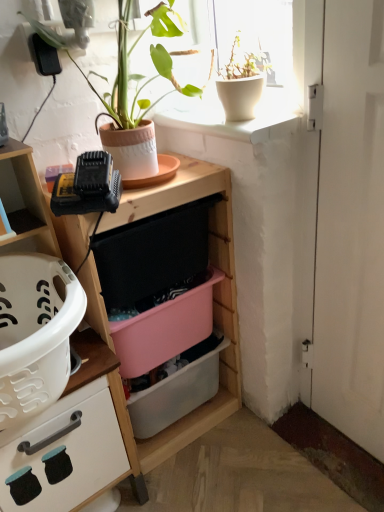
Question: Considering the positions of wooden shelf at center and pink plastic storage box at center, placed as the second storage box when sorted from top to bottom, in the image, is wooden shelf at center bigger or smaller than pink plastic storage box at center, placed as the second storage box when sorted from top to bottom,?

Choices:
 (A) small
 (B) big

Answer: (B)

Question: From the image's perspective, is wooden shelf at center located above or below pink plastic storage box at center, placed as the second storage box when sorted from top to bottom?

Choices:
 (A) below
 (B) above

Answer: (B)

Question: Which of these objects is positioned farthest from the matte wood cabinet at left?

Choices:
 (A) wooden shelf at center
 (B) white matte door at right
 (C) pink plastic storage box at center, which ranks as the 1th storage box in bottom-to-top order
 (D) terracotta clay pot at upper center, arranged as the 2th houseplant when viewed from the right
 (E) white matte pot at upper right, which is the second houseplant in left-to-right order

Answer: (B)

Question: Considering the real-world distances, which object is farthest from the terracotta clay pot at upper center, the first houseplant in the left-to-right sequence?

Choices:
 (A) pink plastic storage box at center, marked as the 1th storage box in a top-to-bottom arrangement
 (B) white matte door at right
 (C) white matte pot at upper right, which is the 1th houseplant in right-to-left order
 (D) wooden shelf at center
 (E) pink plastic storage box at center, which ranks as the 1th storage box in bottom-to-top order

Answer: (E)